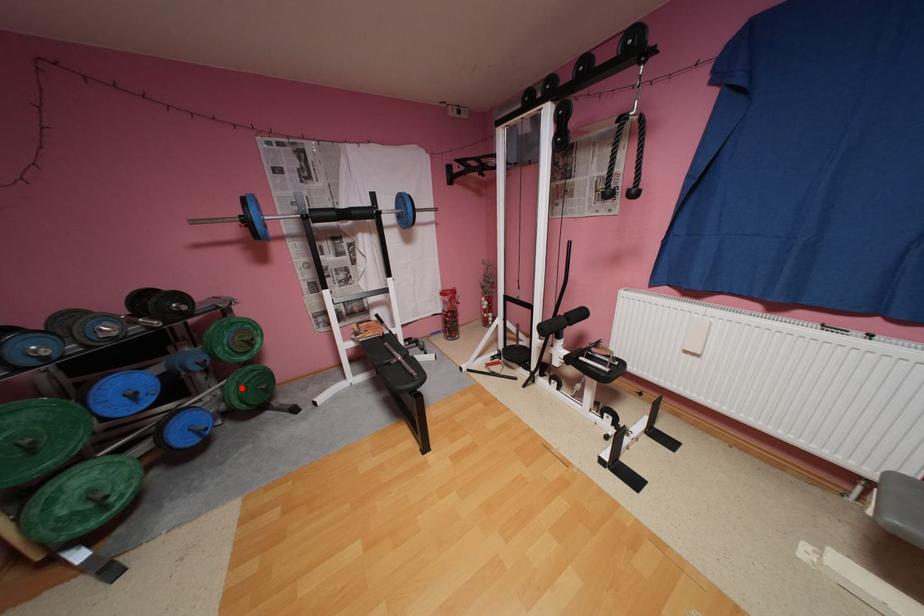
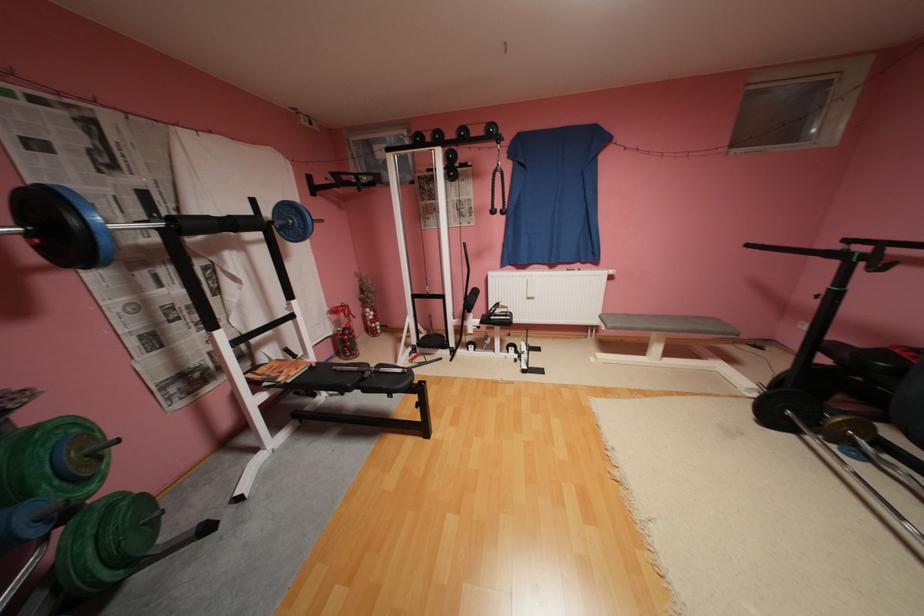
Question: I am providing you with two images of the same scene from different viewpoints. In image1, a red point is highlighted. Considering the same 3D point in image2, which of the following is correct?

Choices:
 (A) It is closer
 (B) It is farther

Answer: (B)